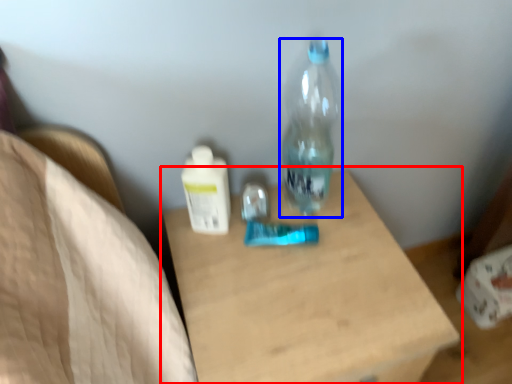
Question: Among these objects, which one is farthest to the camera, table (highlighted by a red box) or bottle (highlighted by a blue box)?

Choices:
 (A) table
 (B) bottle

Answer: (B)